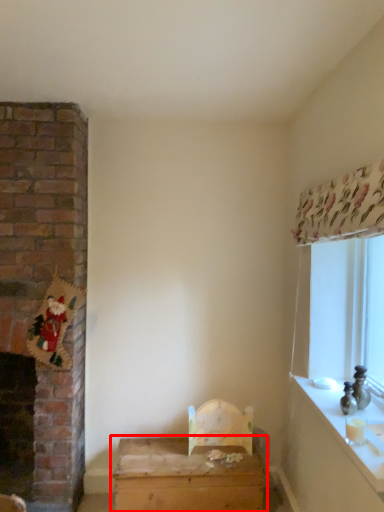
Question: From the image's perspective, where is table (annotated by the red box) located relative to counter top?

Choices:
 (A) below
 (B) above

Answer: (A)